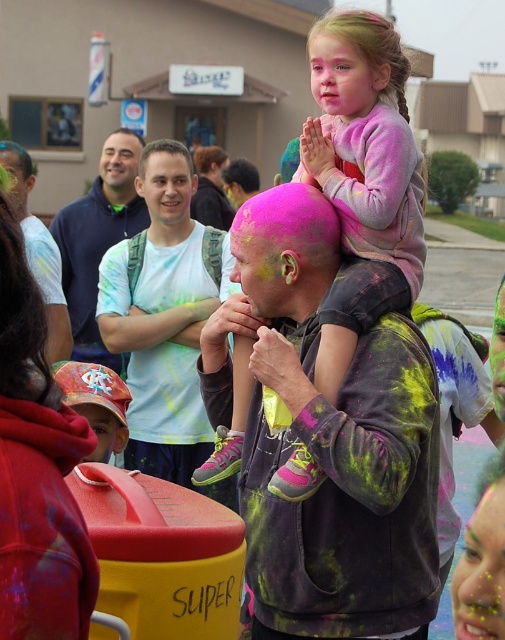
Is the position of matte white face at center more distant than that of green matte face paint at upper center?

Yes.

Does matte white face at center appear on the left side of green matte face paint at upper center?

Yes, matte white face at center is to the left of green matte face paint at upper center.

Who is more forward, (135,154) or (496,365)?

Point (496,365) is more forward.

Locate an element on the screen. matte white face at center is located at coordinates (120, 164).

Consider the image. Is light blue tie-dye t-shirt at center taller than matte black hair at center?

Yes.

Based on the photo, is light blue tie-dye t-shirt at center closer to the viewer compared to matte black hair at center?

That is True.

Is point (152, 355) more distant than point (17, 166)?

No.

The image size is (505, 640). I want to click on light blue tie-dye t-shirt at center, so click(164, 316).

Between light blue tie-dye t-shirt at center and metallic gold face at center, which one has less height?

metallic gold face at center

Can you confirm if light blue tie-dye t-shirt at center is positioned to the left of metallic gold face at center?

Yes, light blue tie-dye t-shirt at center is to the left of metallic gold face at center.

Is point (209, 449) farther from camera compared to point (470, 532)?

Yes, it is.

The height and width of the screenshot is (640, 505). I want to click on light blue tie-dye t-shirt at center, so click(x=164, y=316).